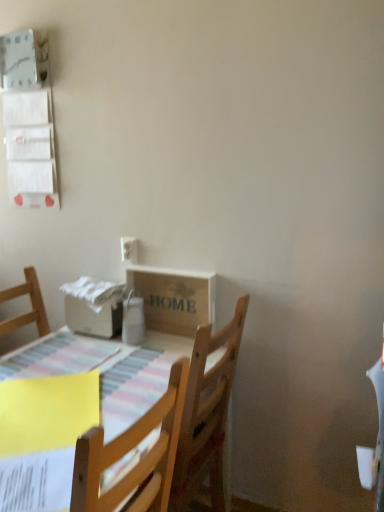
The image size is (384, 512). What are the coordinates of `free spot in front of wooden crate at center` in the screenshot? It's located at (152, 358).